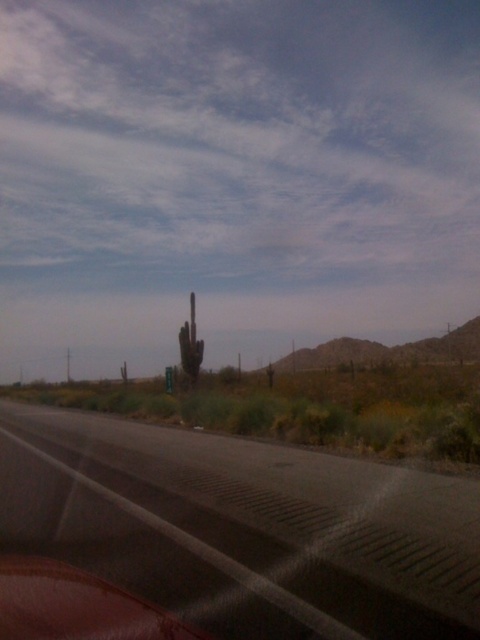
Question: Among these objects, which one is farthest from the camera?

Choices:
 (A) green spiky cactus at center
 (B) black asphalt highway at lower center

Answer: (A)

Question: Which point is farther to the camera?

Choices:
 (A) (187, 346)
 (B) (162, 524)

Answer: (A)

Question: Is the position of black asphalt highway at lower center less distant than that of green spiky cactus at center?

Choices:
 (A) yes
 (B) no

Answer: (A)

Question: Is black asphalt highway at lower center to the left of green spiky cactus at center from the viewer's perspective?

Choices:
 (A) no
 (B) yes

Answer: (A)

Question: From the image, what is the correct spatial relationship of black asphalt highway at lower center in relation to green spiky cactus at center?

Choices:
 (A) below
 (B) above

Answer: (A)